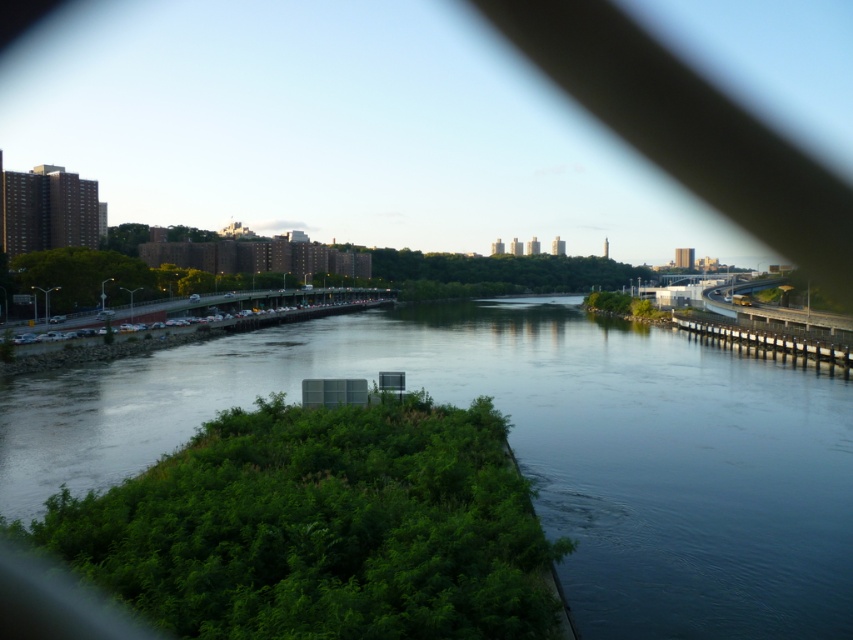
You are standing on the concrete bridge at right and want to cross to the other side of the dark blue water at center. Is the bridge positioned in a way that allows you to reach the opposite bank directly across from the bridge?

The dark blue water at center is to the left of the concrete bridge at right, so the bridge is positioned to the right of the water. This means the bridge is not directly over the water but rather positioned to its right, so crossing the bridge would not lead you directly to the opposite bank across the dark blue water at center. You would need to adjust your path to the left to reach the area directly across from the bridge.

You are a delivery drone with a wingspan of 1.5 meters. You need to fly from the dark blue water at center to the concrete bridge at right. Is there enough space for you to pass through the area between them?

The distance between the dark blue water at center and the concrete bridge at right is 31.57 meters, which is significantly larger than the drone wingspan of 1.5 meters. Yes, there is sufficient space for the drone to pass through safely.

From the picture: You are a photographer planning to capture the entire scene in one shot. Given that your camera can only focus on objects within a 10m width, can you fit both the dark blue water at center and the concrete bridge at right in the frame without cropping?

The dark blue water at center is larger in size than the concrete bridge at right, so yes, both can be captured within the 10m width as the combined size would still be under the limit.